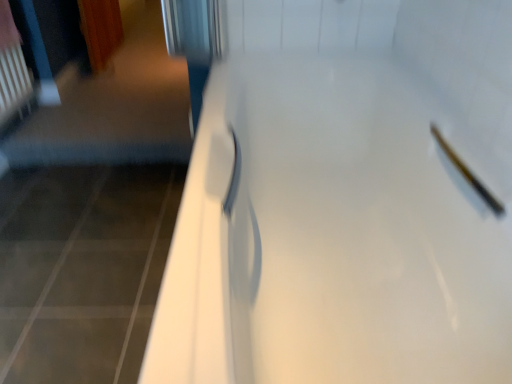
Question: Is matte white showerhead at upper right bigger or smaller than white glossy door at center?

Choices:
 (A) small
 (B) big

Answer: (A)

Question: In the image, is matte white showerhead at upper right on the left side or the right side of white glossy door at center?

Choices:
 (A) right
 (B) left

Answer: (A)

Question: Which is correct: matte white showerhead at upper right is inside white glossy door at center, or outside of it?

Choices:
 (A) outside
 (B) inside

Answer: (B)

Question: Relative to matte white showerhead at upper right, is white glossy door at center in front or behind?

Choices:
 (A) front
 (B) behind

Answer: (A)

Question: Looking at their shapes, would you say white glossy door at center is wider or thinner than matte white showerhead at upper right?

Choices:
 (A) thin
 (B) wide

Answer: (B)

Question: Does point (497, 62) appear closer or farther from the camera than point (480, 190)?

Choices:
 (A) closer
 (B) farther

Answer: (A)

Question: From the image's perspective, is white glossy door at center above or below matte white showerhead at upper right?

Choices:
 (A) above
 (B) below

Answer: (B)